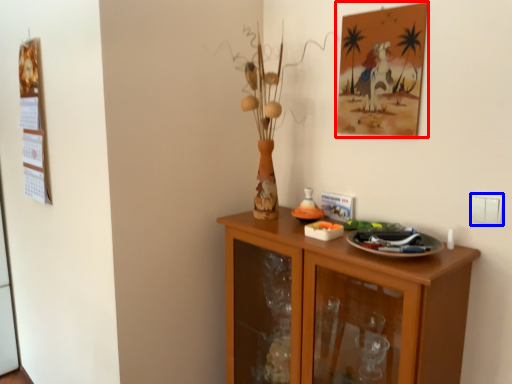
Question: Among these objects, which one is nearest to the camera, picture frame (highlighted by a red box) or electric outlet (highlighted by a blue box)?

Choices:
 (A) picture frame
 (B) electric outlet

Answer: (B)